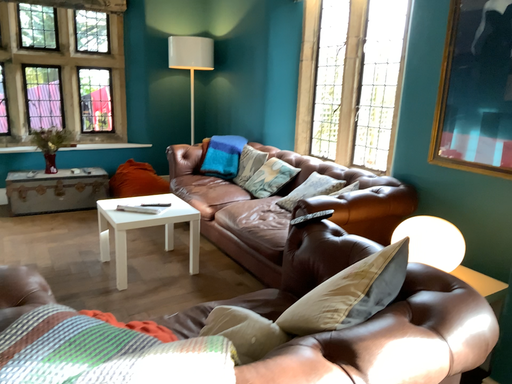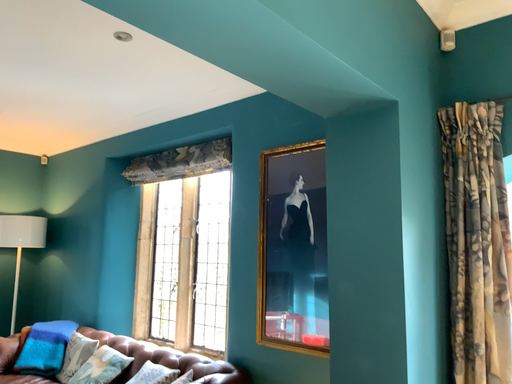
Question: How did the camera likely rotate when shooting the video?

Choices:
 (A) rotated left
 (B) rotated right

Answer: (B)